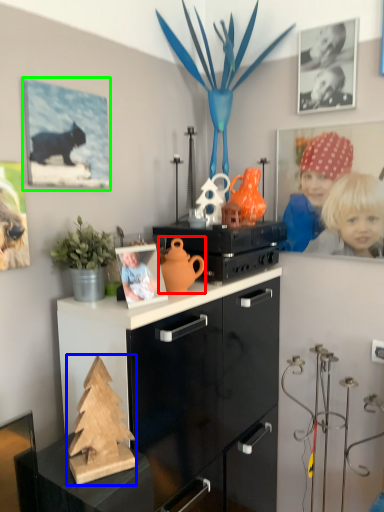
Question: Which is farther away from toy (highlighted by a red box)? christmas tree (highlighted by a blue box) or picture frame (highlighted by a green box)?

Choices:
 (A) christmas tree
 (B) picture frame

Answer: (B)